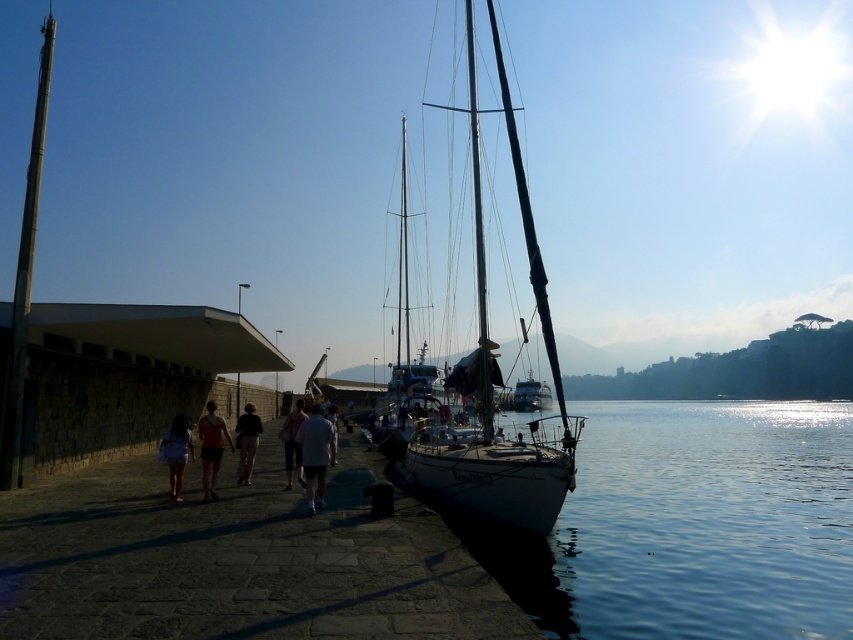
Can you confirm if white matte sailboat at center is positioned below dark blue shorts at center?

No, white matte sailboat at center is not below dark blue shorts at center.

Is white matte sailboat at center smaller than dark blue shorts at center?

Incorrect, white matte sailboat at center is not smaller in size than dark blue shorts at center.

Which is behind, point (492, 403) or point (334, 460)?

Point (492, 403)

You are a GUI agent. You are given a task and a screenshot of the screen. Output one action in this format:
    pyautogui.click(x=<x>, y=<y>)
    Task: Click on the white matte sailboat at center
    
    Given the screenshot: What is the action you would take?
    (492, 381)

Is metallic pole at left to the left of dark blue shorts at center from the viewer's perspective?

Indeed, metallic pole at left is positioned on the left side of dark blue shorts at center.

Is metallic pole at left below dark blue shorts at center?

Actually, metallic pole at left is above dark blue shorts at center.

Is point (19, 452) closer to viewer compared to point (328, 417)?

Yes, point (19, 452) is in front of point (328, 417).

Locate an element on the screen. The image size is (853, 640). metallic pole at left is located at coordinates (24, 275).

Who is positioned more to the right, clear water at boat right or white matte sailboat at center?

clear water at boat right is more to the right.

Does clear water at boat right have a greater width compared to white matte sailboat at center?

Correct, the width of clear water at boat right exceeds that of white matte sailboat at center.

Is point (804, 616) positioned in front of point (492, 512)?

That is True.

Image resolution: width=853 pixels, height=640 pixels. Find the location of `clear water at boat right`. clear water at boat right is located at coordinates (693, 525).